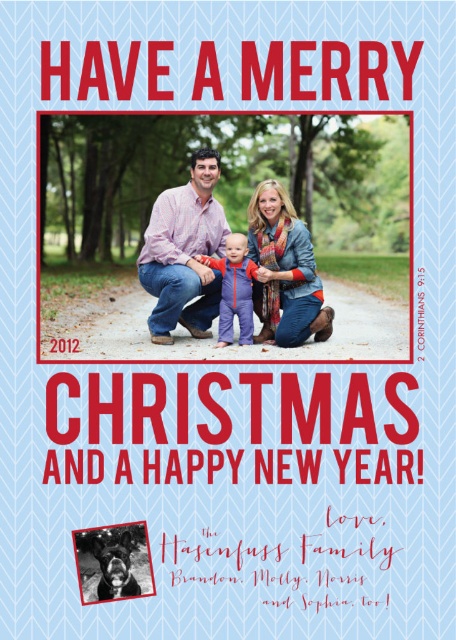
You are designing a digital greeting card and want to place two decorative elements at the coordinates point (175, 307) and point (236, 292). According to the existing image, which point is positioned further back in the visual depth?

Point (175, 307) is behind point (236, 292), so it is positioned further back in the visual depth.